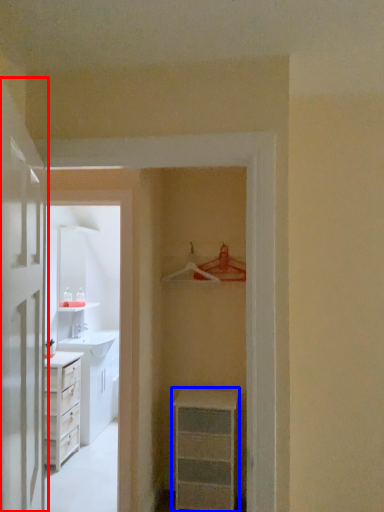
Question: Which object appears closest to the camera in this image, door (highlighted by a red box) or chest of drawers (highlighted by a blue box)?

Choices:
 (A) door
 (B) chest of drawers

Answer: (A)